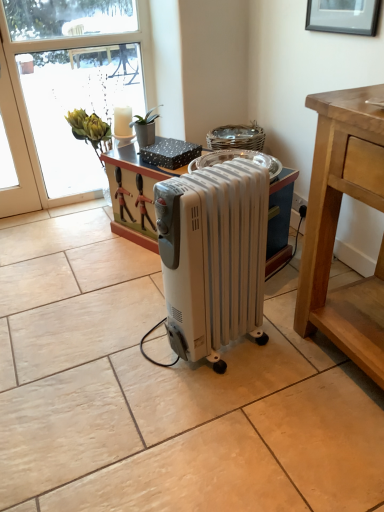
Describe the element at coordinates (343, 16) in the screenshot. I see `black matte picture frame at upper center` at that location.

Describe the element at coordinates (29, 118) in the screenshot. The width and height of the screenshot is (384, 512). I see `transparent glass window at upper left` at that location.

The height and width of the screenshot is (512, 384). I want to click on white plastic radiator at center, so click(x=213, y=255).

Is black matte picture frame at upper center positioned with its back to transparent glass window at upper left?

No.

From a real-world perspective, which object rests below the other?

transparent glass window at upper left, from a real-world perspective.

Looking at this image, considering the sizes of objects black matte picture frame at upper center and transparent glass window at upper left in the image provided, who is taller, black matte picture frame at upper center or transparent glass window at upper left?

With more height is transparent glass window at upper left.

Considering the points (34, 148) and (320, 20), which point is behind, point (34, 148) or point (320, 20)?

The point (34, 148) is farther from the camera.

In the image, there is a black matte picture frame at upper center. Identify the location of window below it (from a real-world perspective). (29, 118).

Considering the sizes of objects transparent glass window at upper left and black matte picture frame at upper center in the image provided, who is shorter, transparent glass window at upper left or black matte picture frame at upper center?

With less height is black matte picture frame at upper center.

Can you confirm if transparent glass window at upper left is thinner than black matte picture frame at upper center?

In fact, transparent glass window at upper left might be wider than black matte picture frame at upper center.

From the picture: From a real-world perspective, which is physically above, white plastic radiator at center or black matte picture frame at upper center?

black matte picture frame at upper center is physically above.

Identify the location of home appliance located below the black matte picture frame at upper center (from the image's perspective). The image size is (384, 512). (213, 255).

Which object is positioned more to the right, white plastic radiator at center or black matte picture frame at upper center?

From the viewer's perspective, black matte picture frame at upper center appears more on the right side.

Does point (176, 225) come in front of point (348, 3)?

Yes, it is.

Can you confirm if white plastic radiator at center is wider than transparent glass window at upper left?

Yes.

Are white plastic radiator at center and transparent glass window at upper left far apart?

white plastic radiator at center is far away from transparent glass window at upper left.

Considering their positions, is white plastic radiator at center located in front of or behind transparent glass window at upper left?

In the image, white plastic radiator at center appears in front of transparent glass window at upper left.

Which is more to the right, white plastic radiator at center or transparent glass window at upper left?

white plastic radiator at center is more to the right.

In terms of height, does transparent glass window at upper left look taller or shorter compared to white plastic radiator at center?

Considering their sizes, transparent glass window at upper left has more height than white plastic radiator at center.

Considering the positions of point (5, 47) and point (185, 248), is point (5, 47) closer or farther from the camera than point (185, 248)?

Clearly, point (5, 47) is more distant from the camera than point (185, 248).

From a real-world perspective, is transparent glass window at upper left below white plastic radiator at center?

No, from a real-world perspective, transparent glass window at upper left is not below white plastic radiator at center.

Considering the positions of objects transparent glass window at upper left and white plastic radiator at center in the image provided, who is behind, transparent glass window at upper left or white plastic radiator at center?

transparent glass window at upper left is behind.

Does black matte picture frame at upper center have a greater height compared to white plastic radiator at center?

No, black matte picture frame at upper center is not taller than white plastic radiator at center.

Which point is more forward, (378,4) or (253,257)?

The point (253,257) is closer to the camera.

Locate an element on the screen. home appliance directly beneath the black matte picture frame at upper center (from a real-world perspective) is located at coordinates (213, 255).

Between black matte picture frame at upper center and white plastic radiator at center, which one has smaller size?

black matte picture frame at upper center.

What are the coordinates of `window to the left of black matte picture frame at upper center` in the screenshot? It's located at (29, 118).

Where is `window behind the black matte picture frame at upper center`? This screenshot has height=512, width=384. window behind the black matte picture frame at upper center is located at coordinates (29, 118).

Looking at the image, which one is located further to transparent glass window at upper left, black matte picture frame at upper center or white plastic radiator at center?

white plastic radiator at center is further to transparent glass window at upper left.

When comparing their distances from transparent glass window at upper left, does white plastic radiator at center or black matte picture frame at upper center seem further?

white plastic radiator at center is further to transparent glass window at upper left.

From the image, which object appears to be nearer to black matte picture frame at upper center, transparent glass window at upper left or white plastic radiator at center?

white plastic radiator at center is closer to black matte picture frame at upper center.

Looking at the image, which one is located further to white plastic radiator at center, transparent glass window at upper left or black matte picture frame at upper center?

transparent glass window at upper left.

From the image, which object appears to be farther from black matte picture frame at upper center, white plastic radiator at center or transparent glass window at upper left?

transparent glass window at upper left lies further to black matte picture frame at upper center than the other object.

Considering their positions, is black matte picture frame at upper center positioned closer to white plastic radiator at center than transparent glass window at upper left?

The object closer to white plastic radiator at center is black matte picture frame at upper center.

The width and height of the screenshot is (384, 512). I want to click on window between black matte picture frame at upper center and white plastic radiator at center in the vertical direction, so click(29, 118).